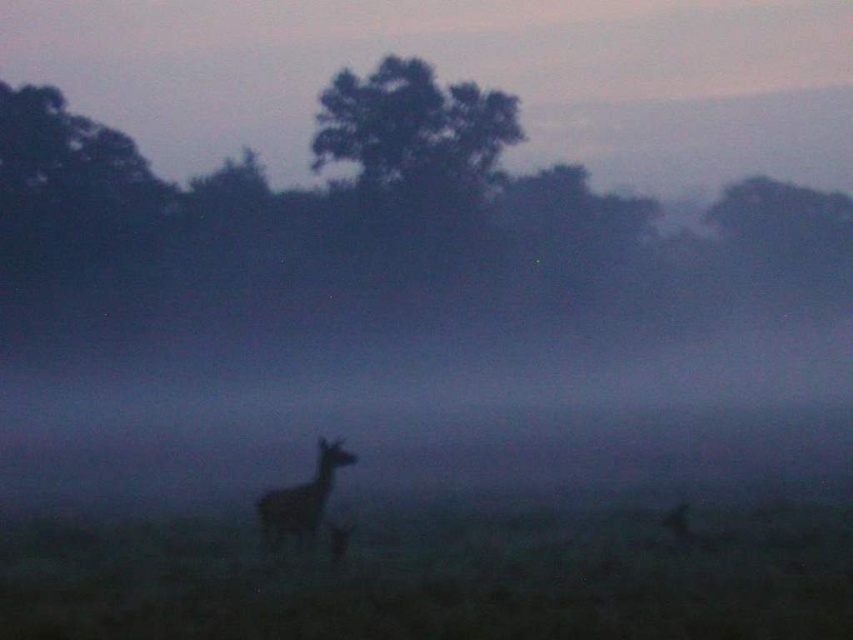
Question: Which point is farther to the camera?

Choices:
 (A) (265, 531)
 (B) (413, 154)

Answer: (B)

Question: Does green leafy tree at upper center come behind silhouette fur deer at center?

Choices:
 (A) no
 (B) yes

Answer: (B)

Question: Can you confirm if green leafy tree at upper center is bigger than silhouette fur deer at center?

Choices:
 (A) no
 (B) yes

Answer: (B)

Question: Which point is closer to the camera taking this photo?

Choices:
 (A) (421, 150)
 (B) (310, 497)

Answer: (B)

Question: Does green leafy tree at upper center appear under silhouette fur deer at center?

Choices:
 (A) no
 (B) yes

Answer: (A)

Question: Which of the following is the farthest from the observer?

Choices:
 (A) (318, 436)
 (B) (451, 131)

Answer: (B)